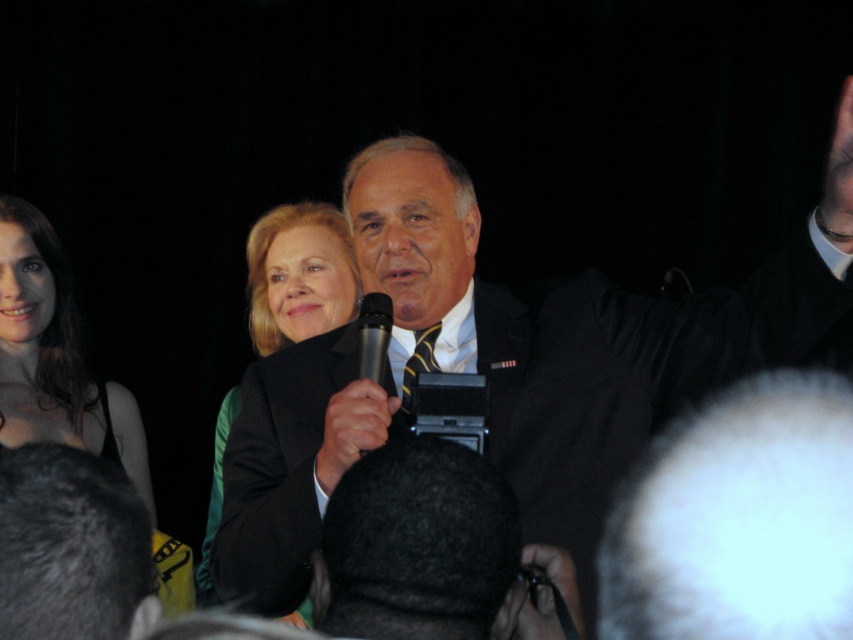
Question: Can you confirm if matte black dress at left is positioned to the right of black matte jacket at center?

Choices:
 (A) yes
 (B) no

Answer: (B)

Question: Which point is farther to the camera?

Choices:
 (A) black matte jacket at center
 (B) matte black dress at left
 (C) black matte microphone at center

Answer: (A)

Question: Is black suit at center thinner than black metallic microphone at center?

Choices:
 (A) yes
 (B) no

Answer: (B)

Question: Does matte black dress at left appear under black metallic microphone at center?

Choices:
 (A) no
 (B) yes

Answer: (B)

Question: Which of the following is the closest to the observer?

Choices:
 (A) matte black suit at center
 (B) matte black dress at left

Answer: (A)

Question: Among these objects, which one is farthest from the camera?

Choices:
 (A) matte black dress at left
 (B) black matte jacket at center

Answer: (B)